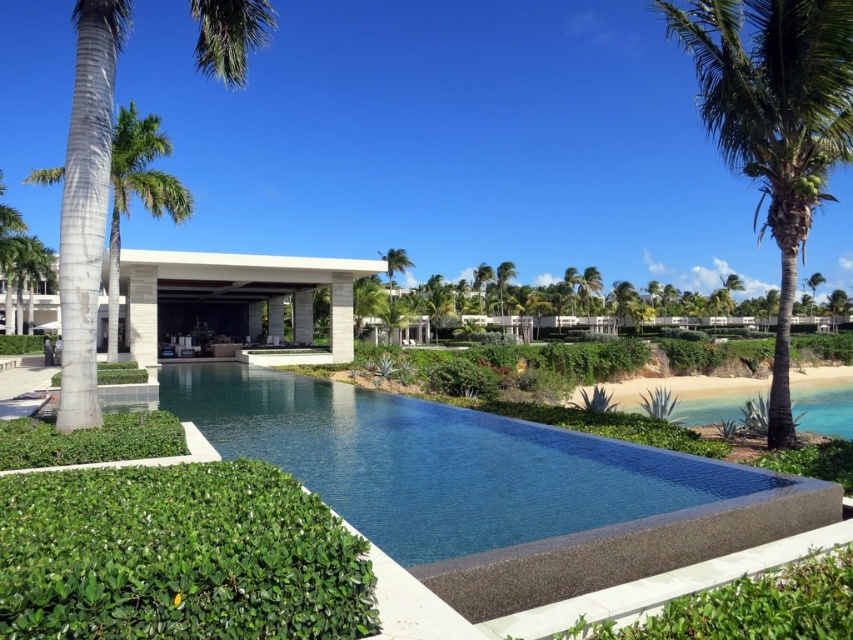
Question: Can you confirm if green leafy hedge at lower left is wider than green leafy palm tree at left?

Choices:
 (A) yes
 (B) no

Answer: (B)

Question: Is beige stone resort at center positioned in front of white concrete pillar at center?

Choices:
 (A) yes
 (B) no

Answer: (A)

Question: Is green leafy hedge at lower center positioned at the back of green leafy palm tree at left?

Choices:
 (A) no
 (B) yes

Answer: (A)

Question: Which object is farther from the camera taking this photo?

Choices:
 (A) green leafy hedge at lower center
 (B) green leafy palm tree at left
 (C) green leafy palm tree at right
 (D) smooth concrete pool at center

Answer: (B)

Question: Among these points, which one is nearest to the camera?

Choices:
 (A) (83, 579)
 (B) (343, 358)
 (C) (601, 621)
 (D) (328, 392)

Answer: (A)

Question: Which of the following is the farthest from the observer?

Choices:
 (A) (112, 486)
 (B) (349, 301)
 (C) (36, 259)

Answer: (C)